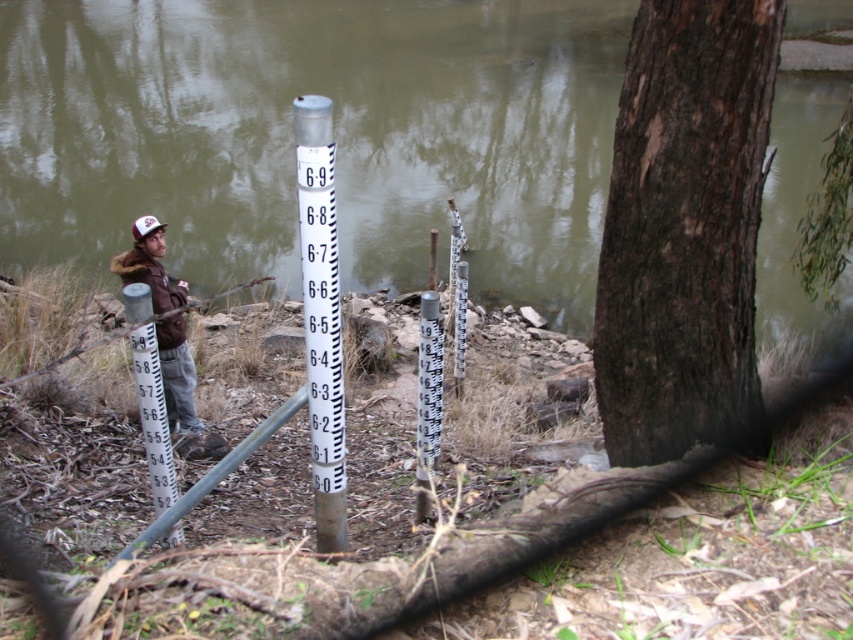
Can you confirm if dark brown bark at center right is bigger than white plastic thermometer at center?

Correct, dark brown bark at center right is larger in size than white plastic thermometer at center.

Between dark brown bark at center right and white plastic thermometer at center, which one has less height?

With less height is white plastic thermometer at center.

I want to click on dark brown bark at center right, so click(x=683, y=227).

Where is `brown fuzzy jacket at left`? brown fuzzy jacket at left is located at coordinates (163, 320).

Between point (134, 234) and point (137, 317), which one is positioned behind?

The point (134, 234) is behind.

Is point (187, 432) more distant than point (146, 406)?

That is True.

The image size is (853, 640). In order to click on brown fuzzy jacket at left in this screenshot , I will do `click(163, 320)`.

Is white plastic pole at left wider than white plastic thermometer at center?

Yes.

Which of these two, white plastic pole at left or white plastic thermometer at center, stands shorter?

Standing shorter between the two is white plastic pole at left.

Between point (148, 422) and point (434, 310), which one is positioned behind?

Point (434, 310)

This screenshot has height=640, width=853. Identify the location of white plastic pole at left. (154, 417).